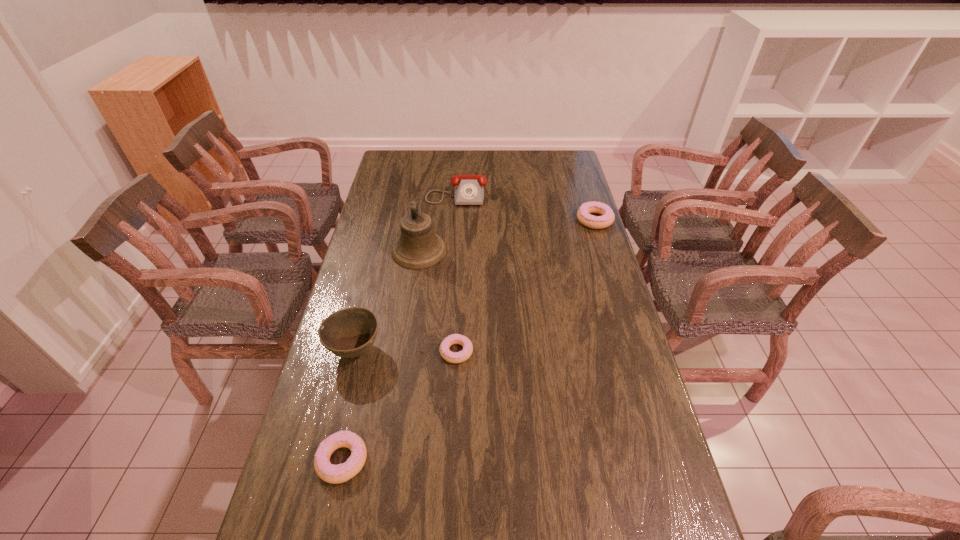
At what (x,y) coordinates should I click in order to perform the action: click on free space between the second doughnut from right to left and the rightmost doughnut. Please return your answer as a coordinate pair (x, y). Looking at the image, I should click on (525, 286).

The width and height of the screenshot is (960, 540). Identify the location of free space between the farthest doughnut and the second nearest doughnut. (525, 286).

This screenshot has width=960, height=540. In order to click on vacant area between the rightmost object and the bowl in this screenshot , I will do `click(475, 285)`.

The image size is (960, 540). I want to click on free spot between the fourth shortest object and the second shortest object, so click(399, 326).

The image size is (960, 540). Identify the location of object identified as the fourth closest to the bowl. pos(469,189).

This screenshot has width=960, height=540. I want to click on object that can be found as the fifth closest to the bell, so click(x=335, y=474).

Choose which doughnut is the nearest neighbor to the nearest doughnut. Please provide its 2D coordinates. Your answer should be formatted as a tuple, i.e. [(x, y)], where the tuple contains the x and y coordinates of a point satisfying the conditions above.

[(458, 357)]

The width and height of the screenshot is (960, 540). I want to click on the closest doughnut to the telephone, so click(x=583, y=214).

The width and height of the screenshot is (960, 540). In order to click on free location that satisfies the following two spatial constraints: 1. on the front side of the shortest doughnut; 2. on the left side of the tallest object in this screenshot , I will do `click(403, 352)`.